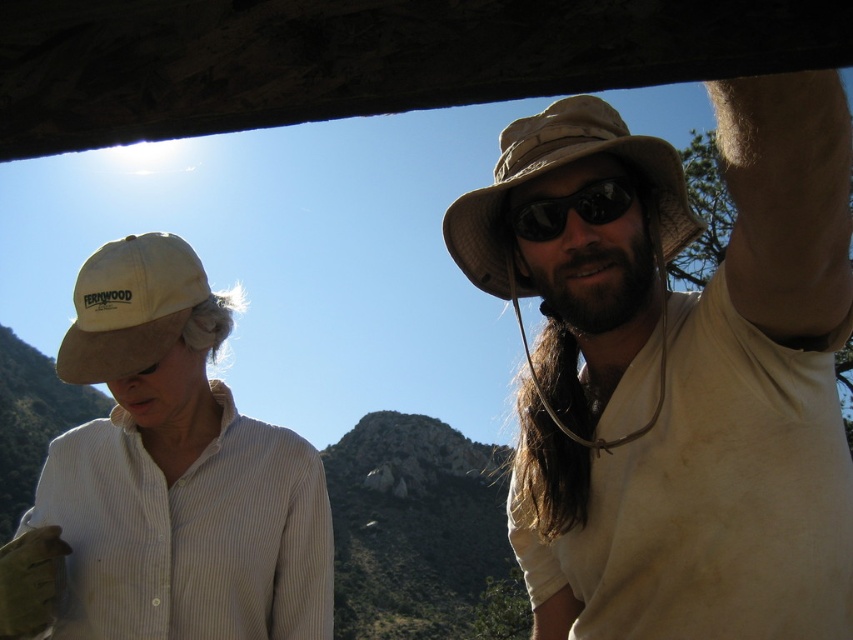
You are a photographer trying to capture a landscape photo. You notice two hats in the scene. Which hat is taller when comparing the matte khaki hat at upper right and the beige fabric cowboy hat at left?

The matte khaki hat at upper right is taller than the beige fabric cowboy hat at left according to the description.

You are a photographer trying to capture both the tan fabric cowboy hat at upper right and the beige fabric cowboy hat at left in a single frame. Based on their positions, which hat should you adjust to ensure both are fully visible in the photo?

The tan fabric cowboy hat at upper right is to the right of the beige fabric cowboy hat at left. To include both in the frame, you should adjust the beige fabric cowboy hat at left to move it further left or the tan fabric cowboy hat at upper right to move it further right so there is enough space between them.